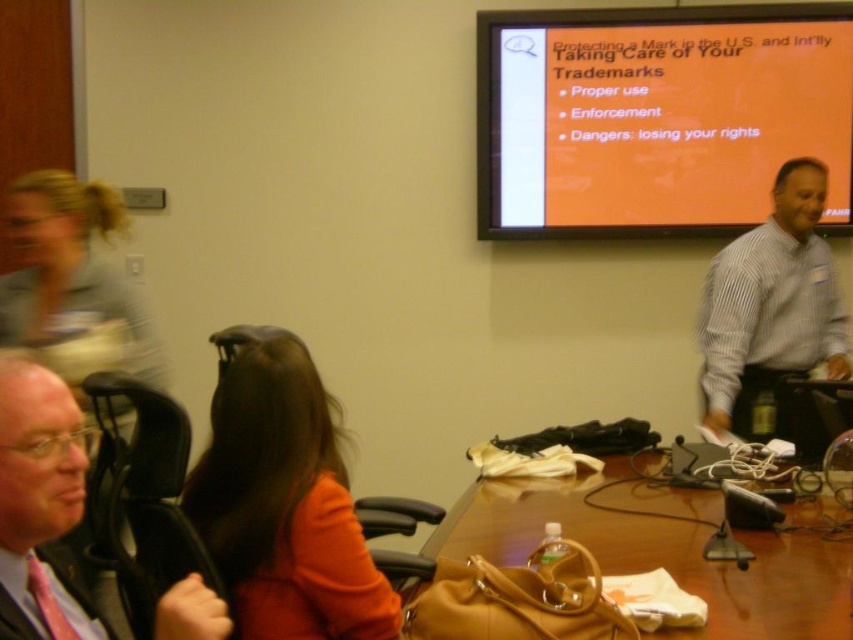
Question: Which of the following is the farthest from the observer?

Choices:
 (A) (9, 529)
 (B) (482, 166)
 (C) (285, 483)

Answer: (B)

Question: Is orange matte projection screen at upper center to the right of white striped shirt at upper right from the viewer's perspective?

Choices:
 (A) yes
 (B) no

Answer: (B)

Question: Is orange matte projection screen at upper center smaller than orange fabric hair at center?

Choices:
 (A) yes
 (B) no

Answer: (B)

Question: Can you confirm if brown leather table at center is positioned to the right of matte black chair at left?

Choices:
 (A) no
 (B) yes

Answer: (B)

Question: Which point is farther to the camera?

Choices:
 (A) (508, 193)
 (B) (65, 499)
 (C) (769, 362)

Answer: (A)

Question: Which object is the farthest from the orange matte projection screen at upper center?

Choices:
 (A) orange fabric hair at center
 (B) white striped shirt at upper right

Answer: (A)